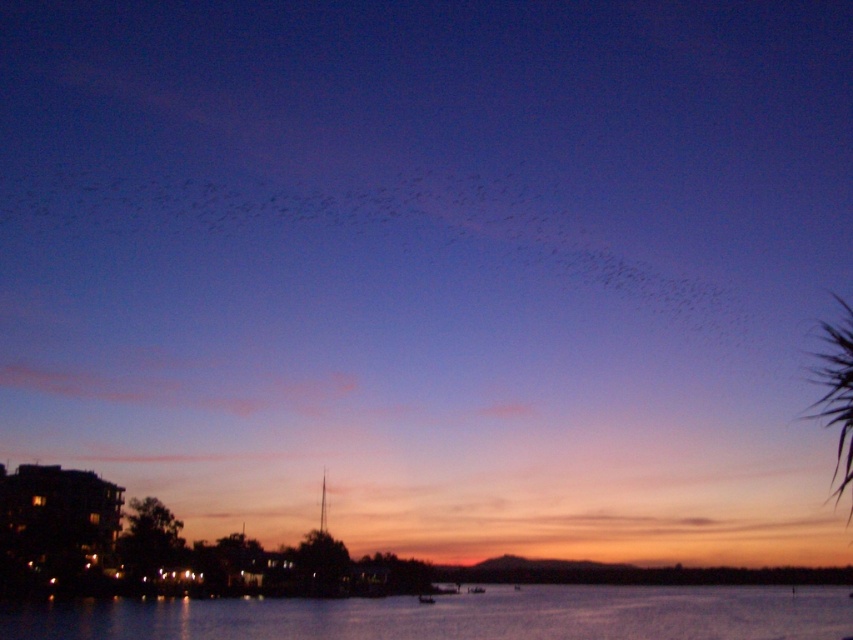
Question: Can you confirm if black matte birds at upper center is thinner than green leafy palm tree at upper right?

Choices:
 (A) yes
 (B) no

Answer: (B)

Question: Among these objects, which one is nearest to the camera?

Choices:
 (A) transparent water at lower center
 (B) green leafy palm tree at upper right
 (C) black matte birds at upper center

Answer: (B)

Question: Does black matte birds at upper center come behind transparent water at lower center?

Choices:
 (A) no
 (B) yes

Answer: (B)

Question: Which point is farther from the camera taking this photo?

Choices:
 (A) (640, 275)
 (B) (502, 592)
 (C) (833, 490)

Answer: (A)

Question: Which object is the closest to the green leafy palm tree at upper right?

Choices:
 (A) transparent water at lower center
 (B) black matte birds at upper center

Answer: (A)

Question: Is transparent water at lower center smaller than green leafy palm tree at upper right?

Choices:
 (A) yes
 (B) no

Answer: (A)